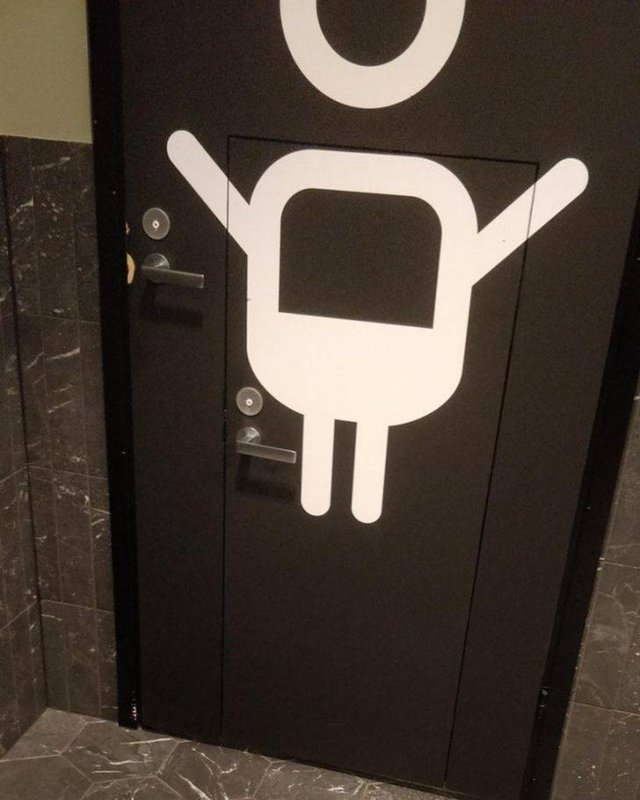
Locate an element on the screen. The width and height of the screenshot is (640, 800). wall is located at coordinates (602, 593).